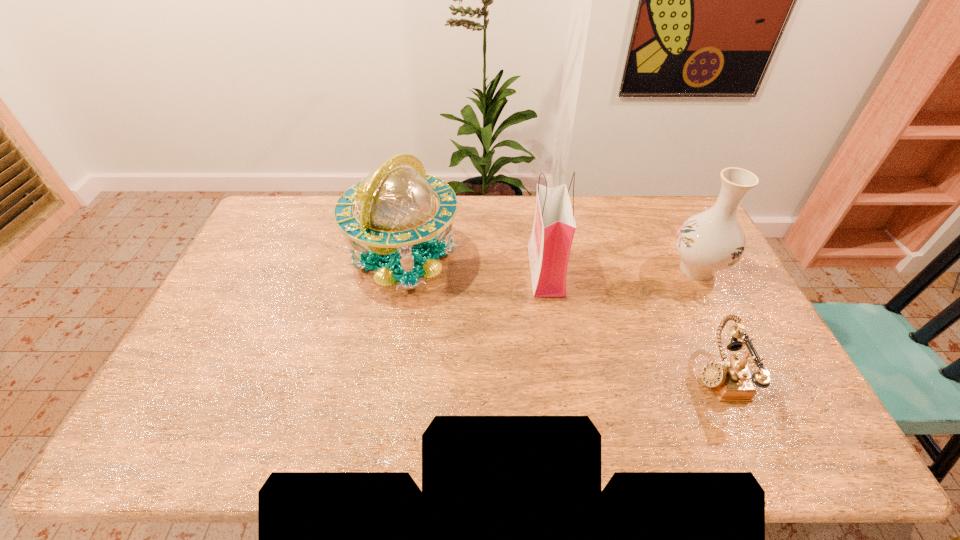
Where is `the leftmost object`? Image resolution: width=960 pixels, height=540 pixels. the leftmost object is located at coordinates (396, 206).

What are the coordinates of `the second object from left to right` in the screenshot? It's located at (549, 247).

Identify the location of vase. The image size is (960, 540). click(x=710, y=241).

This screenshot has width=960, height=540. What are the coordinates of `telephone` in the screenshot? It's located at (731, 380).

I want to click on the shortest object, so click(731, 380).

Find the location of a particular element. The width and height of the screenshot is (960, 540). vacant position located 0.220m on the left of the globe is located at coordinates (281, 259).

The height and width of the screenshot is (540, 960). I want to click on free space located 0.220m on the front-facing side of the second object from left to right, so click(x=463, y=271).

This screenshot has width=960, height=540. In order to click on free point located on the front-facing side of the second object from left to right in this screenshot , I will do `click(460, 271)`.

Locate an element on the screen. blank space located on the front-facing side of the second object from left to right is located at coordinates (436, 271).

You are a GUI agent. You are given a task and a screenshot of the screen. Output one action in this format:
    pyautogui.click(x=<x>, y=<y>)
    Task: Click on the vacant space situated on the left of the vase
    This screenshot has height=540, width=960.
    Given the screenshot: What is the action you would take?
    pyautogui.click(x=624, y=269)